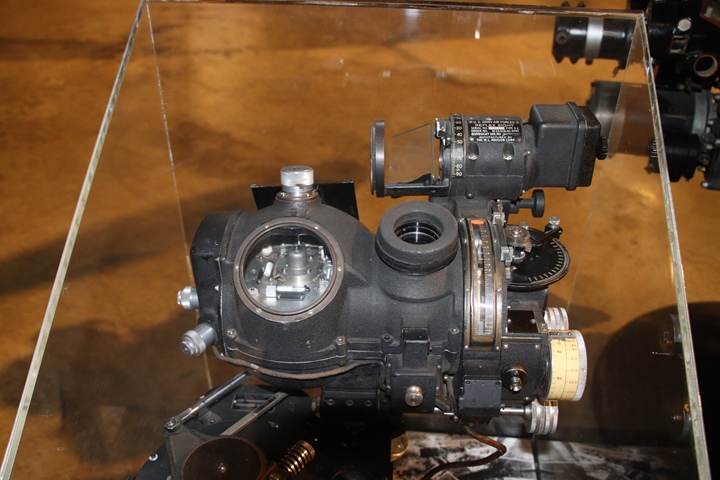
Identify the location of right glass case wall. (618, 336).